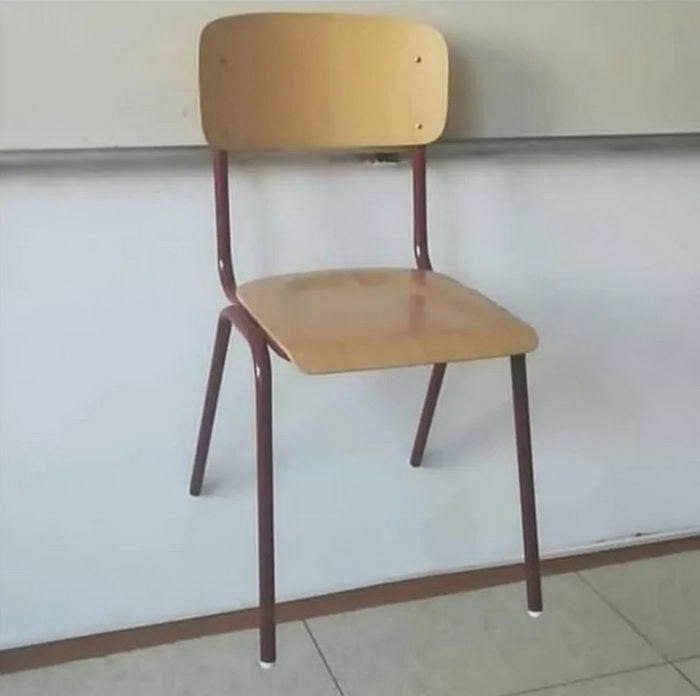
I want to click on chair, so click(x=406, y=308).